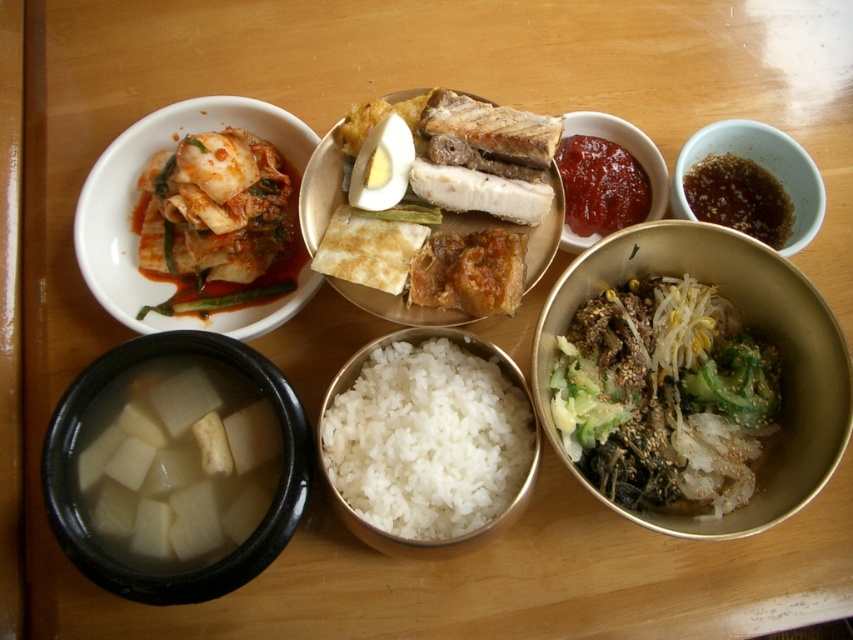
You are a customer at a Korean restaurant and want to reach for the kimchi bowl. The kimchi bowl is located at point (94, 412). There is another dish at point (614, 417). Which point do you need to reach towards first to get the kimchi bowl without moving the other dish?

You need to reach towards point (94, 412) first because point (614, 417) is behind it, so accessing the kimchi bowl at point (94, 412) doesn